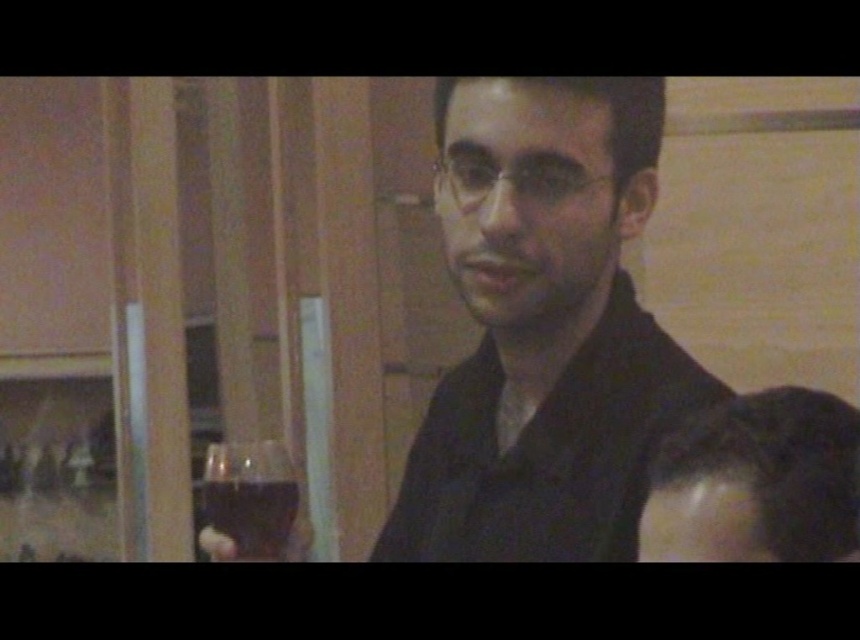
You are a photographer trying to capture a closeup of the dark brown hair at lower right. If your camera has a minimum focusing distance of 50 centimeters, will you be able to take the photo without moving the camera closer?

The dark brown hair at lower right and camera are 54.93 centimeters apart from each other, which is greater than the minimum focusing distance of 50 centimeters. Therefore, you can take the photo without moving the camera closer.

Based on the photo, you are a photographer trying to capture a closeup of the transparent glass at left without including the matte black shirt at center in the frame. Based on their positions and sizes, do you think this is possible?

The matte black shirt at center might be wider than transparent glass at left, so there is a possibility that the shirt could block the view of the glass if they are positioned closely. To ensure the glass is framed without the shirt, adjust the angle or move closer to isolate the glass.

You are a photographer setting up a shot in this scene. You need to position a light source so that it illuminates the matte black shirt at center without affecting the transparent glass at left. Based on their positions, where should you place the light source?

Since the matte black shirt at center is above the transparent glass at left, placing the light source below the transparent glass at left would illuminate the shirt from underneath while avoiding direct light on the glass.